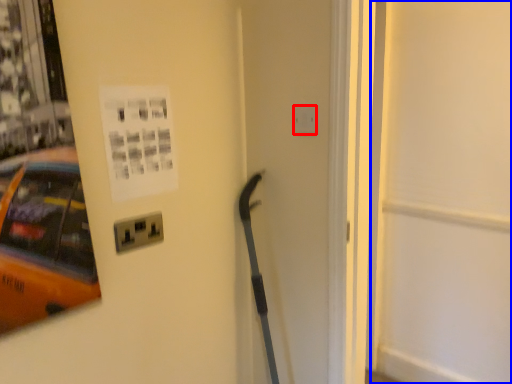
Question: Among these objects, which one is nearest to the camera, electric outlet (highlighted by a red box) or door (highlighted by a blue box)?

Choices:
 (A) electric outlet
 (B) door

Answer: (B)